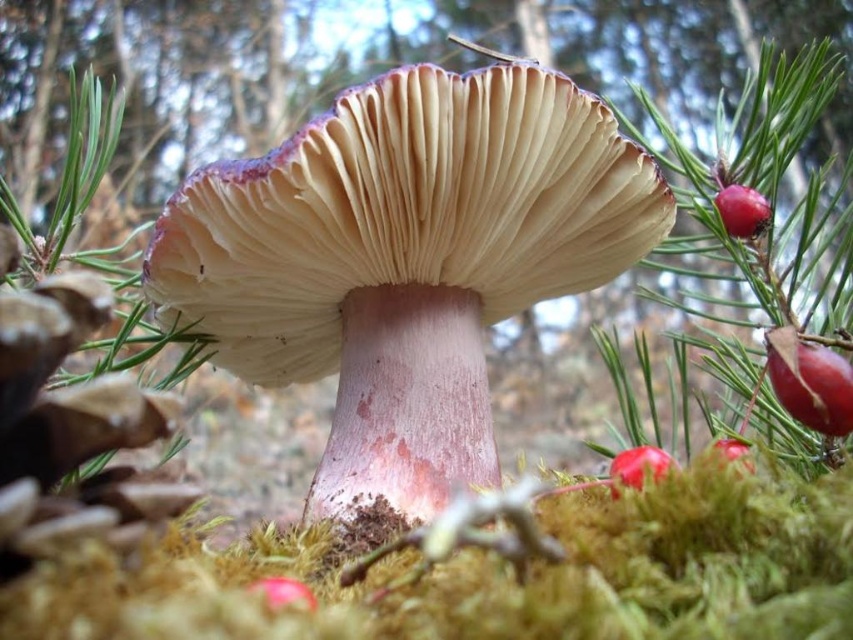
Is glossy red berry at lower right shorter than glossy red berry at center right?

No, glossy red berry at lower right is not shorter than glossy red berry at center right.

Where is `glossy red berry at lower right`? glossy red berry at lower right is located at coordinates (639, 465).

Which of these two, glossy red berry at upper right or glossy red berry at lower right, stands taller?

Standing taller between the two is glossy red berry at upper right.

Can you confirm if glossy red berry at upper right is positioned above glossy red berry at lower right?

Yes.

You are a GUI agent. You are given a task and a screenshot of the screen. Output one action in this format:
    pyautogui.click(x=<x>, y=<y>)
    Task: Click on the glossy red berry at upper right
    This screenshot has height=640, width=853.
    Given the screenshot: What is the action you would take?
    pyautogui.click(x=741, y=211)

Does glossy red berry at upper right have a larger size compared to glossy red berry at center right?

Incorrect, glossy red berry at upper right is not larger than glossy red berry at center right.

Which of these two, glossy red berry at upper right or glossy red berry at center right, stands shorter?

With less height is glossy red berry at center right.

I want to click on glossy red berry at upper right, so click(x=741, y=211).